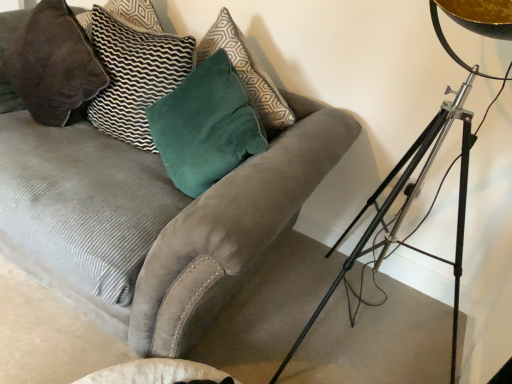
Question: Is velvet gray couch at center inside velvet dark brown pillow at upper left, positioned as the 1th pillow in left-to-right order?

Choices:
 (A) yes
 (B) no

Answer: (B)

Question: Does velvet dark brown pillow at upper left, positioned as the 1th pillow in left-to-right order, have a lesser height compared to velvet gray couch at center?

Choices:
 (A) yes
 (B) no

Answer: (A)

Question: Can you confirm if velvet dark brown pillow at upper left, the second pillow from the right, is wider than velvet gray couch at center?

Choices:
 (A) no
 (B) yes

Answer: (A)

Question: Is velvet dark brown pillow at upper left, positioned as the 1th pillow in left-to-right order, next to velvet gray couch at center?

Choices:
 (A) yes
 (B) no

Answer: (B)

Question: Can you confirm if velvet dark brown pillow at upper left, the second pillow from the right, is taller than velvet gray couch at center?

Choices:
 (A) yes
 (B) no

Answer: (B)

Question: Considering the relative positions of velvet gray couch at center and metallic tripod at right in the image provided, is velvet gray couch at center to the left or to the right of metallic tripod at right?

Choices:
 (A) left
 (B) right

Answer: (A)

Question: In terms of height, does velvet gray couch at center look taller or shorter compared to metallic tripod at right?

Choices:
 (A) short
 (B) tall

Answer: (A)

Question: Is velvet gray couch at center in front of or behind metallic tripod at right in the image?

Choices:
 (A) front
 (B) behind

Answer: (B)

Question: From a real-world perspective, is velvet gray couch at center positioned above or below metallic tripod at right?

Choices:
 (A) below
 (B) above

Answer: (A)

Question: Is velvet gray couch at center to the left or to the right of velvet green pillow at upper left, the second pillow positioned from the left, in the image?

Choices:
 (A) left
 (B) right

Answer: (A)

Question: From a real-world perspective, is velvet gray couch at center above or below velvet green pillow at upper left, the first pillow from the right?

Choices:
 (A) below
 (B) above

Answer: (A)

Question: Is velvet gray couch at center inside or outside of velvet green pillow at upper left, the first pillow from the right?

Choices:
 (A) outside
 (B) inside

Answer: (A)

Question: In terms of width, does velvet gray couch at center look wider or thinner when compared to velvet green pillow at upper left, the second pillow positioned from the left?

Choices:
 (A) thin
 (B) wide

Answer: (B)

Question: Relative to velvet gray couch at center, is velvet dark brown pillow at upper left, positioned as the 1th pillow in left-to-right order, in front or behind?

Choices:
 (A) front
 (B) behind

Answer: (B)

Question: Is velvet dark brown pillow at upper left, the second pillow from the right, bigger or smaller than velvet gray couch at center?

Choices:
 (A) small
 (B) big

Answer: (A)